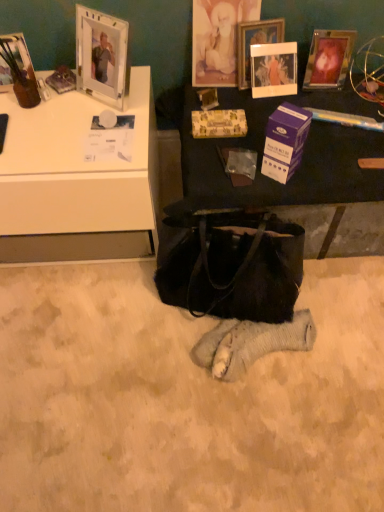
Question: Is matte black table at center closer to the viewer compared to purple cardboard box at center?

Choices:
 (A) no
 (B) yes

Answer: (A)

Question: From a real-world perspective, is matte black table at center on top of purple cardboard box at center?

Choices:
 (A) no
 (B) yes

Answer: (A)

Question: Would you say matte black table at center is outside purple cardboard box at center?

Choices:
 (A) no
 (B) yes

Answer: (B)

Question: Is matte black table at center further to camera compared to purple cardboard box at center?

Choices:
 (A) no
 (B) yes

Answer: (B)

Question: Is matte black table at center thinner than purple cardboard box at center?

Choices:
 (A) no
 (B) yes

Answer: (A)

Question: From the image's perspective, is matte black table at center over purple cardboard box at center?

Choices:
 (A) no
 (B) yes

Answer: (B)

Question: Considering the relative sizes of black leather handbag at center and metallic silver picture frame at upper right, marked as the 4th picture frame in a left-to-right arrangement, in the image provided, is black leather handbag at center smaller than metallic silver picture frame at upper right, marked as the 4th picture frame in a left-to-right arrangement,?

Choices:
 (A) no
 (B) yes

Answer: (A)

Question: Is black leather handbag at center taller than metallic silver picture frame at upper right, marked as the 4th picture frame in a left-to-right arrangement?

Choices:
 (A) no
 (B) yes

Answer: (B)

Question: Is black leather handbag at center far away from metallic silver picture frame at upper right, marked as the 4th picture frame in a left-to-right arrangement?

Choices:
 (A) yes
 (B) no

Answer: (B)

Question: Can you confirm if black leather handbag at center is positioned to the right of metallic silver picture frame at upper right, placed as the first picture frame when sorted from right to left?

Choices:
 (A) no
 (B) yes

Answer: (A)

Question: Are black leather handbag at center and metallic silver picture frame at upper right, placed as the first picture frame when sorted from right to left, making contact?

Choices:
 (A) yes
 (B) no

Answer: (B)

Question: Does black leather handbag at center turn towards metallic silver picture frame at upper right, placed as the first picture frame when sorted from right to left?

Choices:
 (A) no
 (B) yes

Answer: (A)

Question: Does gold textured picture frame at upper center, which is the second picture frame in left-to-right order, lie in front of matte glass picture frame at upper left, placed as the first picture frame when sorted from left to right?

Choices:
 (A) yes
 (B) no

Answer: (B)